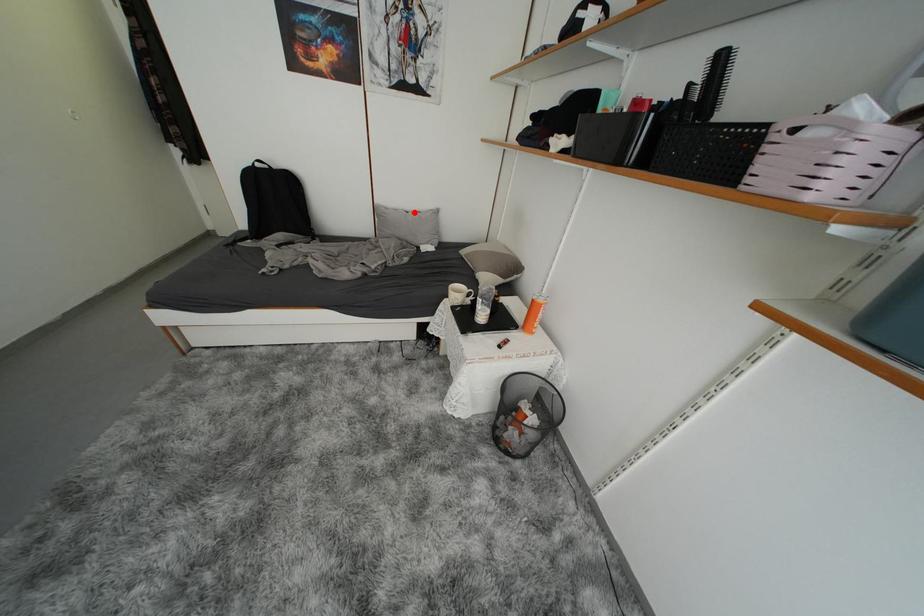
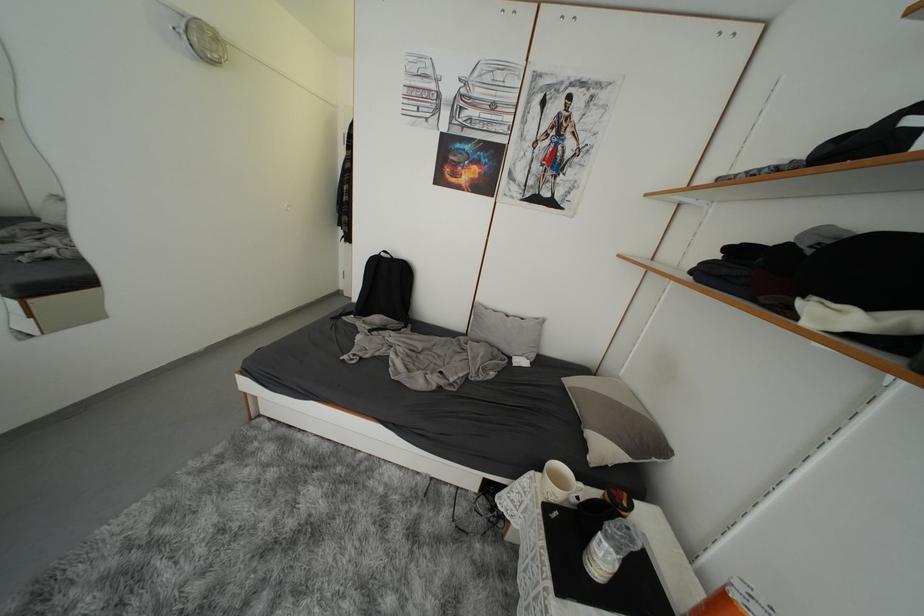
The point at the highlighted location is marked in the first image. Where is the corresponding point in the second image?

(516, 315)